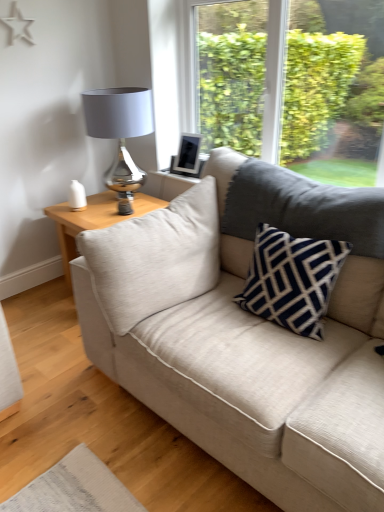
What is the approximate width of navy blue textured pillow at center?

navy blue textured pillow at center is 11.75 inches in width.

At what (x,y) coordinates should I click in order to perform the action: click on matte silver table lamp at upper left. Please return your answer as a coordinate pair (x, y). The height and width of the screenshot is (512, 384). Looking at the image, I should click on (120, 134).

The image size is (384, 512). What do you see at coordinates (246, 334) in the screenshot?
I see `beige fabric couch at center` at bounding box center [246, 334].

Where is `light wood/texture side table at left`? light wood/texture side table at left is located at coordinates (93, 220).

Identify the location of navy blue textured pillow at center. click(x=292, y=279).

Is light wood/texture side table at left facing towards beige fabric couch at center?

No.

Is light wood/texture side table at left inside the boundaries of beige fabric couch at center, or outside?

light wood/texture side table at left is outside beige fabric couch at center.

Based on the photo, from the image's perspective, which one is positioned higher, light wood/texture side table at left or beige fabric couch at center?

From the image's view, light wood/texture side table at left is above.

Is light wood/texture side table at left bigger than beige fabric couch at center?

No.

From the image's perspective, between beige fabric couch at center and navy blue textured pillow at center, which one is located above?

navy blue textured pillow at center, from the image's perspective.

Considering the positions of points (274, 360) and (270, 295), is point (274, 360) farther from camera compared to point (270, 295)?

No, it is not.

Is beige fabric couch at center to the right of navy blue textured pillow at center from the viewer's perspective?

No, beige fabric couch at center is not to the right of navy blue textured pillow at center.

Does beige fabric couch at center have a greater width compared to navy blue textured pillow at center?

Yes.

Is navy blue textured pillow at center positioned with its back to matte silver table lamp at upper left?

navy blue textured pillow at center is not turned away from matte silver table lamp at upper left.

Which is more to the right, navy blue textured pillow at center or matte silver table lamp at upper left?

Positioned to the right is navy blue textured pillow at center.

From a real-world perspective, is navy blue textured pillow at center under matte silver table lamp at upper left?

Yes, from a real-world perspective, navy blue textured pillow at center is beneath matte silver table lamp at upper left.

Considering the points (269, 276) and (96, 130), which point is in front, point (269, 276) or point (96, 130)?

The point (269, 276) is more forward.

Considering the positions of points (89, 225) and (128, 135), is point (89, 225) closer to camera compared to point (128, 135)?

That is True.

Which is in front, light wood/texture side table at left or matte silver table lamp at upper left?

light wood/texture side table at left is in front.

Is light wood/texture side table at left completely or partially outside of matte silver table lamp at upper left?

light wood/texture side table at left is positioned outside matte silver table lamp at upper left.

Does light wood/texture side table at left have a larger size compared to matte silver table lamp at upper left?

Yes.

Does light wood/texture side table at left turn towards navy blue textured pillow at center?

No, light wood/texture side table at left is not facing towards navy blue textured pillow at center.

Which is more to the right, light wood/texture side table at left or navy blue textured pillow at center?

Positioned to the right is navy blue textured pillow at center.

From the picture: Is light wood/texture side table at left thinner than navy blue textured pillow at center?

No, light wood/texture side table at left is not thinner than navy blue textured pillow at center.

Between light wood/texture side table at left and navy blue textured pillow at center, which one has smaller size?

With smaller size is navy blue textured pillow at center.

Based on the photo, is beige fabric couch at center far away from light wood/texture side table at left?

beige fabric couch at center is near light wood/texture side table at left, not far away.

Where is `table below the beige fabric couch at center (from a real-world perspective)`? The width and height of the screenshot is (384, 512). table below the beige fabric couch at center (from a real-world perspective) is located at coordinates (93, 220).

Visually, is beige fabric couch at center positioned to the left or to the right of light wood/texture side table at left?

From the image, it's evident that beige fabric couch at center is to the right of light wood/texture side table at left.

In the scene shown: From the image's perspective, is matte silver table lamp at upper left under light wood/texture side table at left?

No, from the image's perspective, matte silver table lamp at upper left is not below light wood/texture side table at left.

Is matte silver table lamp at upper left positioned beyond the bounds of light wood/texture side table at left?

matte silver table lamp at upper left lies outside light wood/texture side table at left's area.

Can you tell me how much matte silver table lamp at upper left and light wood/texture side table at left differ in facing direction?

There is a 44.9-degree angle between the facing directions of matte silver table lamp at upper left and light wood/texture side table at left.

Is matte silver table lamp at upper left taller than light wood/texture side table at left?

Indeed, matte silver table lamp at upper left has a greater height compared to light wood/texture side table at left.

Identify the location of studio couch in front of the light wood/texture side table at left. (246, 334).

The height and width of the screenshot is (512, 384). What are the coordinates of `studio couch below the navy blue textured pillow at center (from the image's perspective)` in the screenshot? It's located at (246, 334).

Estimate the real-world distances between objects in this image. Which object is closer to navy blue textured pillow at center, matte silver table lamp at upper left or beige fabric couch at center?

beige fabric couch at center is positioned closer to the anchor navy blue textured pillow at center.

From the image, which object appears to be nearer to beige fabric couch at center, matte silver table lamp at upper left or navy blue textured pillow at center?

The object closer to beige fabric couch at center is navy blue textured pillow at center.

When comparing their distances from light wood/texture side table at left, does navy blue textured pillow at center or beige fabric couch at center seem closer?

beige fabric couch at center is positioned closer to the anchor light wood/texture side table at left.

Based on their spatial positions, is navy blue textured pillow at center or light wood/texture side table at left closer to matte silver table lamp at upper left?

The object closer to matte silver table lamp at upper left is light wood/texture side table at left.

Based on their spatial positions, is light wood/texture side table at left or beige fabric couch at center further from matte silver table lamp at upper left?

Based on the image, beige fabric couch at center appears to be further to matte silver table lamp at upper left.

Which object lies nearer to the anchor point matte silver table lamp at upper left, beige fabric couch at center or navy blue textured pillow at center?

The object closer to matte silver table lamp at upper left is beige fabric couch at center.

From the image, which object appears to be nearer to light wood/texture side table at left, beige fabric couch at center or matte silver table lamp at upper left?

Among the two, matte silver table lamp at upper left is located nearer to light wood/texture side table at left.

Looking at this image, estimate the real-world distances between objects in this image. Which object is further from matte silver table lamp at upper left, navy blue textured pillow at center or beige fabric couch at center?

navy blue textured pillow at center is positioned further to the anchor matte silver table lamp at upper left.

Find the location of a particular element. pillow between beige fabric couch at center and light wood/texture side table at left along the z-axis is located at coordinates (292, 279).

Locate an element on the screen. pillow located between beige fabric couch at center and matte silver table lamp at upper left in the depth direction is located at coordinates (292, 279).

Locate an element on the screen. This screenshot has width=384, height=512. table between navy blue textured pillow at center and matte silver table lamp at upper left along the z-axis is located at coordinates (93, 220).

Identify the location of table located between beige fabric couch at center and matte silver table lamp at upper left in the depth direction. (93, 220).